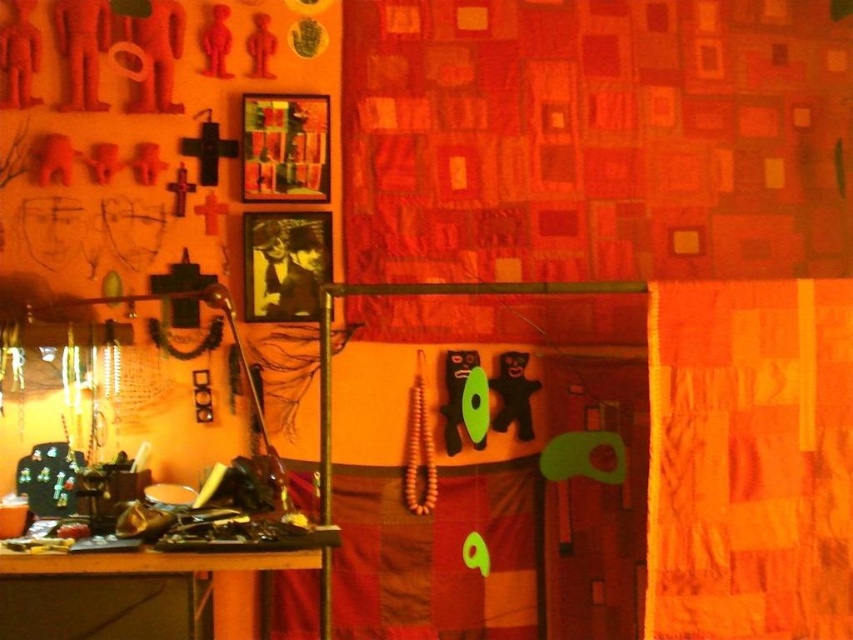
Question: Can you confirm if orange quilted curtain at upper right is positioned below wooden table at lower left?

Choices:
 (A) no
 (B) yes

Answer: (A)

Question: Does orange quilted curtain at upper right have a lesser width compared to wooden table at lower left?

Choices:
 (A) yes
 (B) no

Answer: (A)

Question: Which of the following is the farthest from the observer?

Choices:
 (A) (712, 481)
 (B) (32, 570)

Answer: (A)

Question: Which object appears closest to the camera in this image?

Choices:
 (A) orange quilted curtain at upper right
 (B) wooden table at lower left

Answer: (B)

Question: Does orange quilted curtain at upper right have a larger size compared to wooden table at lower left?

Choices:
 (A) no
 (B) yes

Answer: (B)